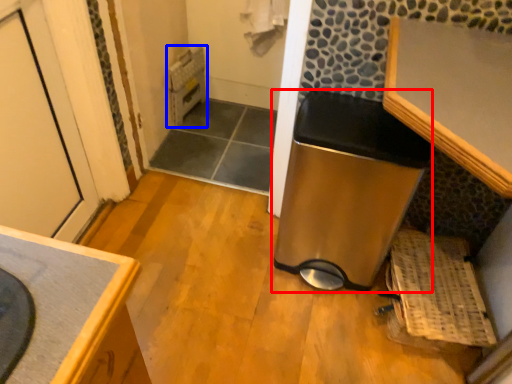
Question: Among these objects, which one is nearest to the camera, water heater (highlighted by a red box) or water heater (highlighted by a blue box)?

Choices:
 (A) water heater
 (B) water heater

Answer: (A)